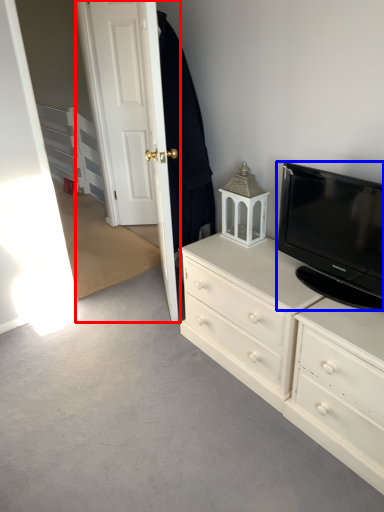
Question: Among these objects, which one is nearest to the camera, door (highlighted by a red box) or television (highlighted by a blue box)?

Choices:
 (A) door
 (B) television

Answer: (B)